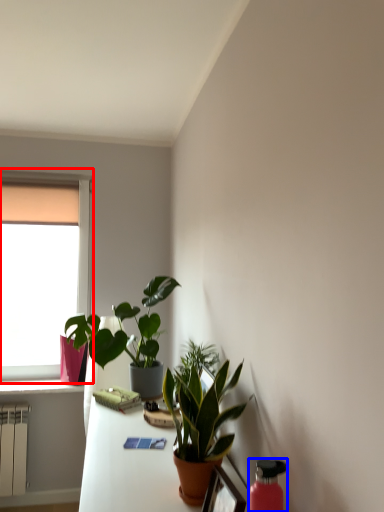
Question: Among these objects, which one is nearest to the camera, window (highlighted by a red box) or bottle (highlighted by a blue box)?

Choices:
 (A) window
 (B) bottle

Answer: (B)